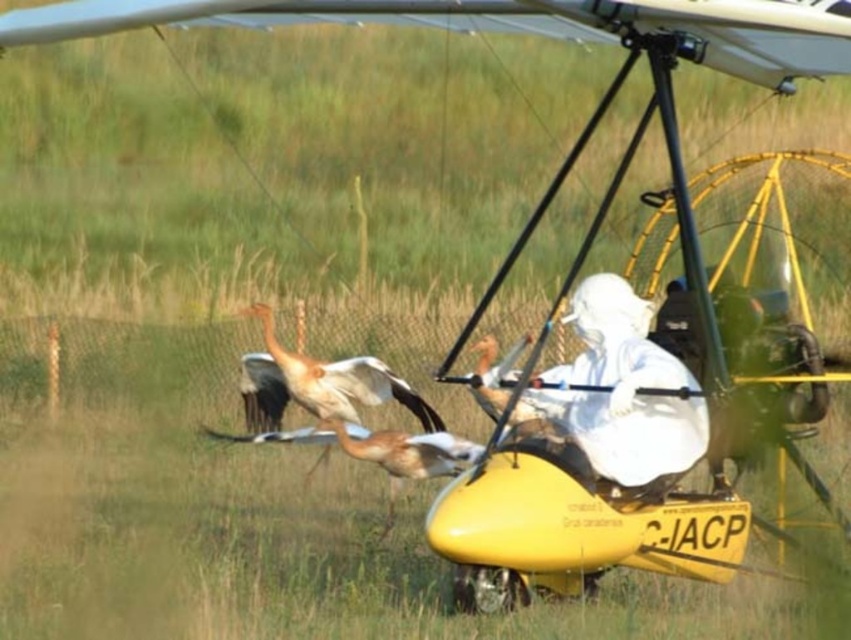
You are a wildlife photographer observing the scene from a distance. You notice both the white matte suit at center and the white feathered bird at center in your camera viewfinder. Which object should you focus on if you want to capture the larger subject in detail?

The white matte suit at center is much taller than the white feathered bird at center, so you should focus on the white matte suit at center to capture the larger subject in detail.